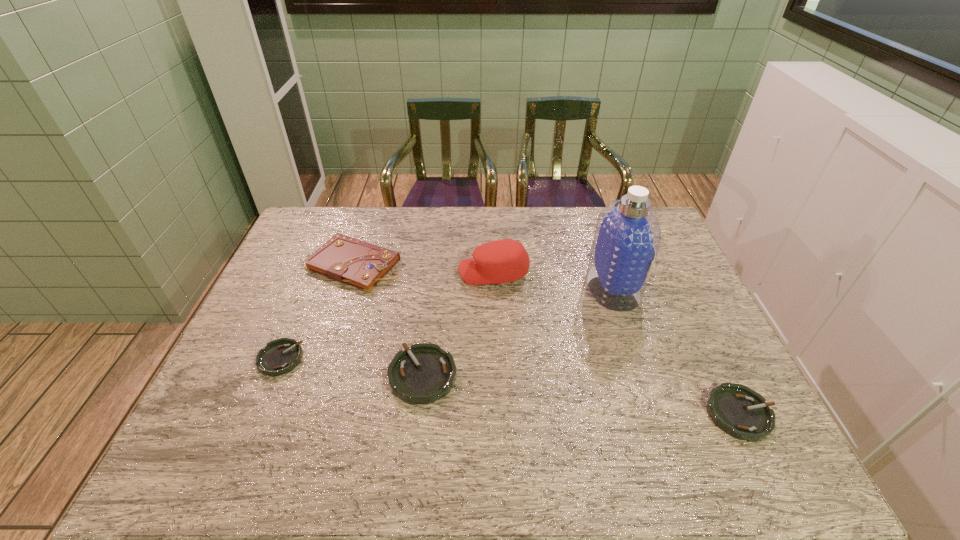
In order to click on notebook situated at the left edge in this screenshot , I will do `click(347, 260)`.

I want to click on ashtray at the right edge, so (736, 409).

Where is `cleansing agent that is at the right edge`? The height and width of the screenshot is (540, 960). cleansing agent that is at the right edge is located at coordinates (627, 236).

Locate an element on the screen. object that is at the far left corner is located at coordinates (347, 260).

This screenshot has height=540, width=960. I want to click on object at the near right corner, so click(736, 409).

This screenshot has height=540, width=960. What are the coordinates of `free region at the far edge of the desktop` in the screenshot? It's located at (524, 235).

Locate an element on the screen. The width and height of the screenshot is (960, 540). free space at the near edge is located at coordinates (300, 413).

At what (x,y) coordinates should I click in order to perform the action: click on free location at the left edge of the desktop. Please return your answer as a coordinate pair (x, y). Looking at the image, I should click on (254, 335).

Where is `free spot at the right edge of the desktop`? The width and height of the screenshot is (960, 540). free spot at the right edge of the desktop is located at coordinates (708, 328).

The width and height of the screenshot is (960, 540). I want to click on vacant space at the near left corner of the desktop, so click(x=219, y=416).